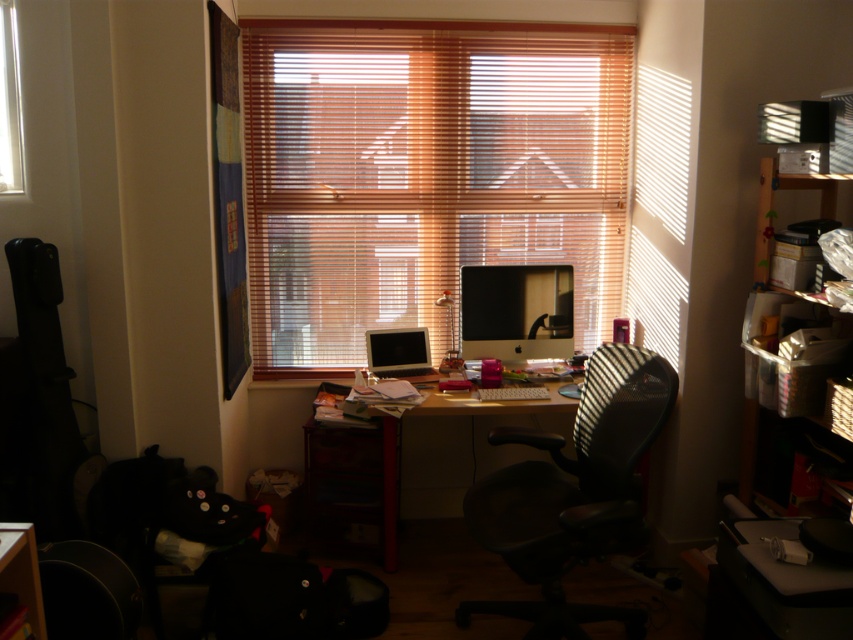
Question: In this image, where is satin black monitor at center located relative to transparent glass window at upper left?

Choices:
 (A) right
 (B) left

Answer: (A)

Question: Can you confirm if matte wooden desk at center is positioned to the left of matte black monitor at center?

Choices:
 (A) yes
 (B) no

Answer: (B)

Question: Which object is positioned farthest from the transparent glass window at upper left?

Choices:
 (A) satin black monitor at center
 (B) wooden shelves at right
 (C) black mesh office chair at center
 (D) matte wooden desk at center

Answer: (B)

Question: Which point appears closest to the camera in this image?

Choices:
 (A) (16, 173)
 (B) (496, 435)
 (C) (788, 291)
 (D) (535, 356)

Answer: (C)

Question: Among these objects, which one is farthest from the camera?

Choices:
 (A) matte black monitor at center
 (B) satin black monitor at center
 (C) transparent glass window at upper left

Answer: (B)

Question: Is wooden blinds at center behind satin black monitor at center?

Choices:
 (A) yes
 (B) no

Answer: (B)